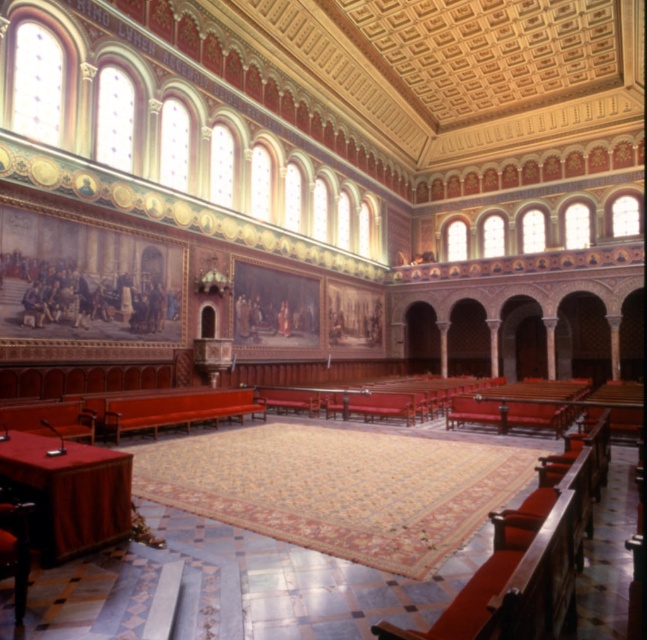
Can you confirm if matte red bench at center is shorter than metallic polished chair at lower left?

In fact, matte red bench at center may be taller than metallic polished chair at lower left.

Who is more distant from viewer, (160, 408) or (12, 540)?

The point (160, 408) is behind.

Is point (116, 413) farther from camera compared to point (0, 547)?

Yes, point (116, 413) is behind point (0, 547).

Locate an element on the screen. This screenshot has height=640, width=647. matte red bench at center is located at coordinates (179, 410).

Is matte red bench at center thinner than wooden polished bench at lower left?

Incorrect, matte red bench at center's width is not less than wooden polished bench at lower left's.

Which is below, matte red bench at center or wooden polished bench at lower left?

matte red bench at center

Between point (162, 410) and point (69, 428), which one is positioned behind?

Point (162, 410)

I want to click on matte red bench at center, so click(179, 410).

Is point (25, 557) positioned after point (69, 417)?

No, (25, 557) is in front of (69, 417).

Who is lower down, metallic polished chair at lower left or wooden polished bench at lower left?

wooden polished bench at lower left

Identify the location of metallic polished chair at lower left. The height and width of the screenshot is (640, 647). (14, 545).